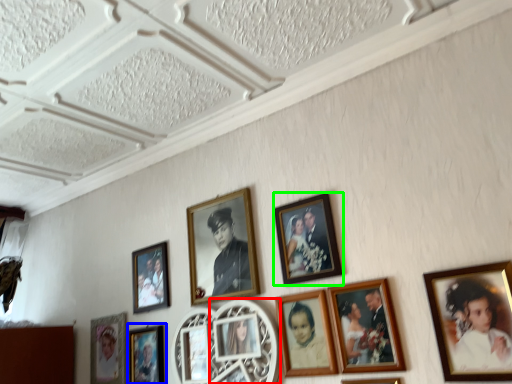
Question: Which object is the closest to the picture frame (highlighted by a red box)? Choose among these: picture frame (highlighted by a blue box) or picture frame (highlighted by a green box).

Choices:
 (A) picture frame
 (B) picture frame

Answer: (B)